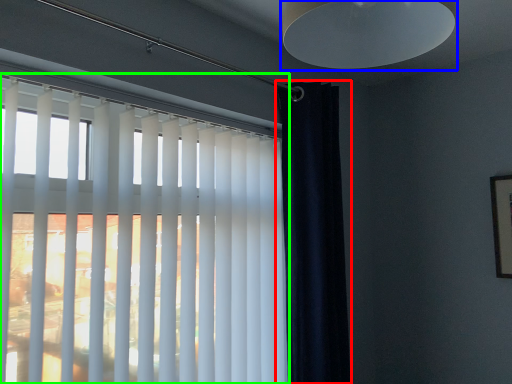
Question: Which object is positioned farthest from curtain (highlighted by a red box)? Select from lamp (highlighted by a blue box) and window blind (highlighted by a green box).

Choices:
 (A) lamp
 (B) window blind

Answer: (A)